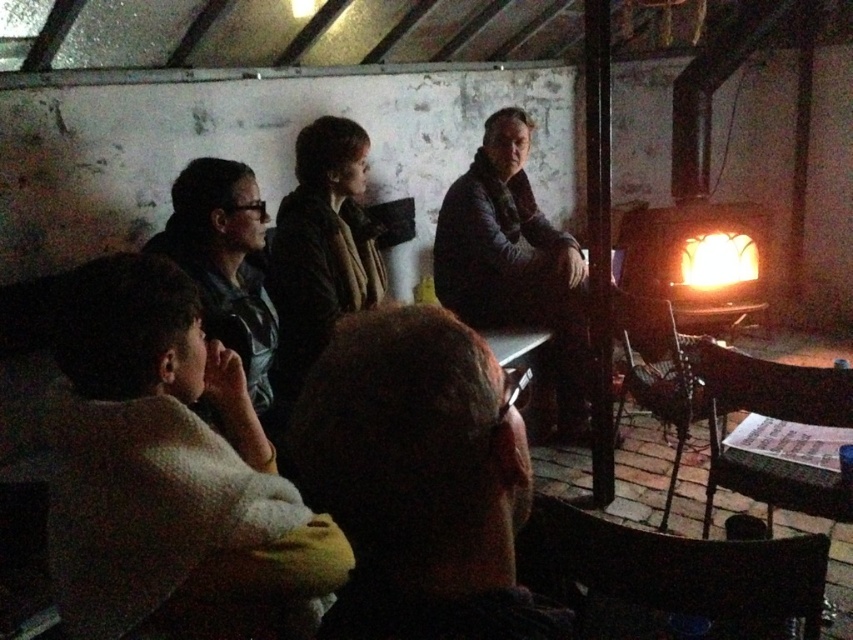
Who is more distant from viewer, (451, 580) or (241, 317)?

Point (241, 317)

Can you confirm if brown hair at center is positioned to the right of matte black jacket at left?

Indeed, brown hair at center is positioned on the right side of matte black jacket at left.

What do you see at coordinates (419, 480) in the screenshot?
I see `brown hair at center` at bounding box center [419, 480].

Image resolution: width=853 pixels, height=640 pixels. I want to click on brown hair at center, so click(x=419, y=480).

Does brown hair at center have a lesser width compared to dark blue leather jacket at center?

Indeed, brown hair at center has a lesser width compared to dark blue leather jacket at center.

What do you see at coordinates (419, 480) in the screenshot? The width and height of the screenshot is (853, 640). I see `brown hair at center` at bounding box center [419, 480].

Where is `brown hair at center`? The width and height of the screenshot is (853, 640). brown hair at center is located at coordinates (419, 480).

Can you confirm if dark blue leather jacket at center is positioned below matte black jacket at left?

Actually, dark blue leather jacket at center is above matte black jacket at left.

Which is in front, point (473, 272) or point (260, 298)?

Point (260, 298) is in front.

Between point (560, 257) and point (260, 308), which one is positioned in front?

Positioned in front is point (260, 308).

Locate an element on the screen. This screenshot has height=640, width=853. dark blue leather jacket at center is located at coordinates (515, 262).